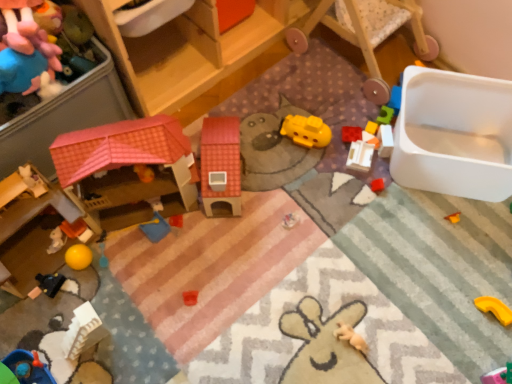
I want to click on free space between black matte toy car at lower left, the tenth toy viewed from the right, and blue fabric toy at center, arranged as the third toy when viewed from the left, so click(112, 256).